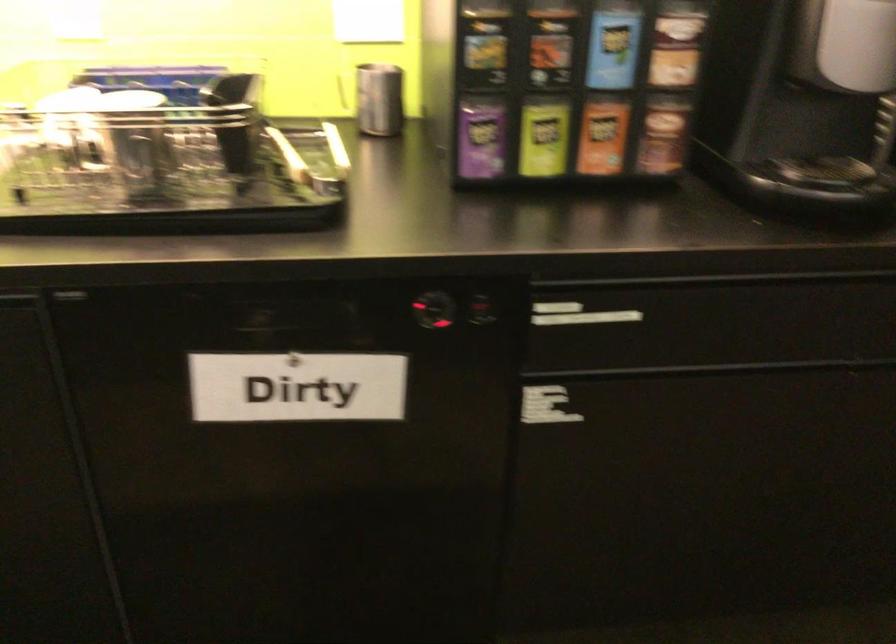
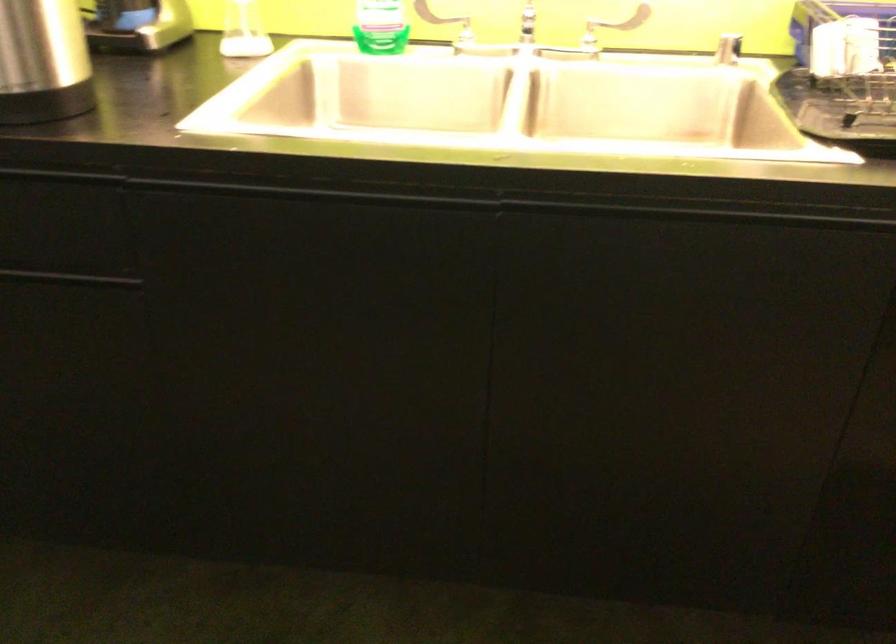
Question: The images are taken continuously from a first-person perspective. In which direction is your viewpoint rotating?

Choices:
 (A) Left
 (B) Right
 (C) Up
 (D) Down

Answer: (A)